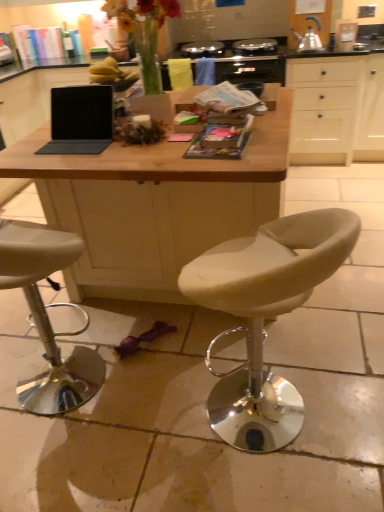
Where is `free location to the left of matte paper magazine at center, which is counted as the 1th magazine, starting from the bottom`? This screenshot has width=384, height=512. free location to the left of matte paper magazine at center, which is counted as the 1th magazine, starting from the bottom is located at coordinates (150, 162).